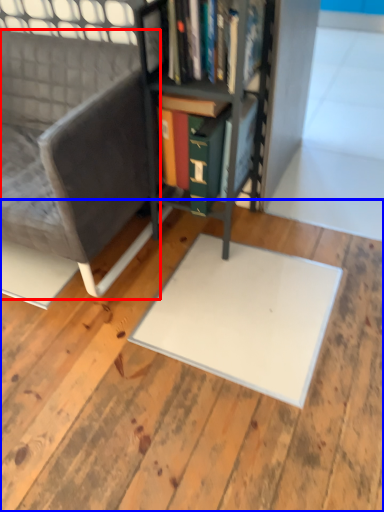
Question: Which object is further to the camera taking this photo, chair (highlighted by a red box) or plywood (highlighted by a blue box)?

Choices:
 (A) chair
 (B) plywood

Answer: (A)